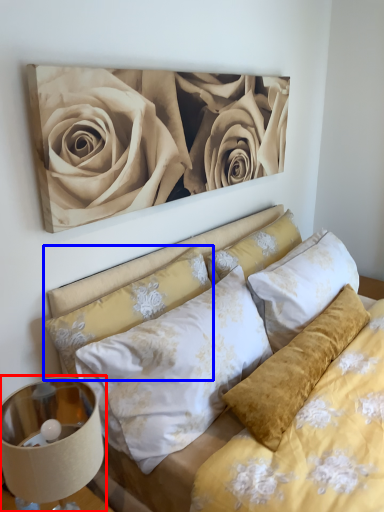
Question: Which object is closer to the camera taking this photo, lamp (highlighted by a red box) or pillow (highlighted by a blue box)?

Choices:
 (A) lamp
 (B) pillow

Answer: (A)